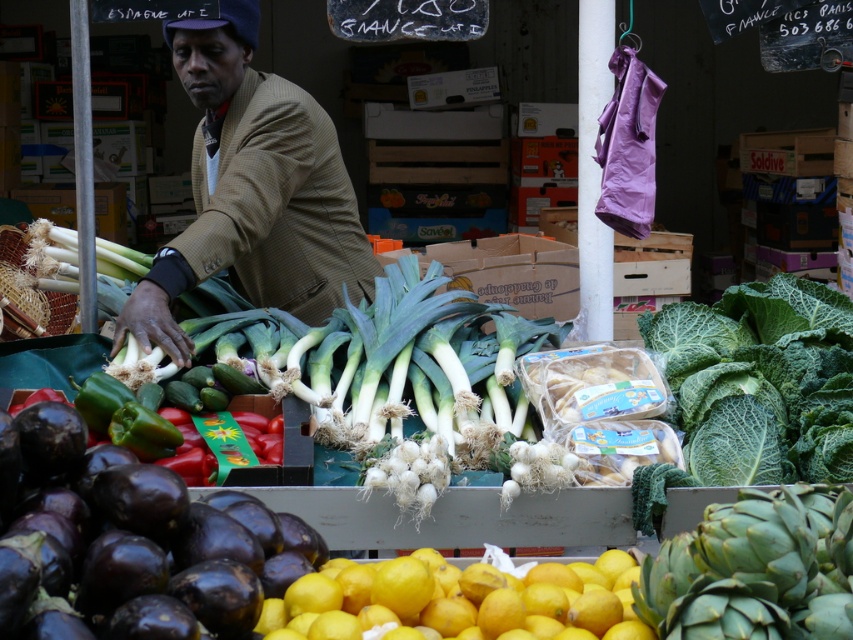
Question: Can you confirm if brown woolen jacket at center is positioned to the right of green leafy artichoke at lower right?

Choices:
 (A) no
 (B) yes

Answer: (A)

Question: Which point appears closest to the camera in this image?

Choices:
 (A) (520, 593)
 (B) (762, 552)
 (C) (276, 109)

Answer: (B)

Question: Which of these objects is positioned closest to the brown woolen jacket at center?

Choices:
 (A) yellow matte lemons at lower center
 (B) green leafy artichoke at lower right

Answer: (A)

Question: Which point is farther to the camera?

Choices:
 (A) yellow matte lemons at lower center
 (B) green leafy artichoke at lower right

Answer: (A)

Question: Is brown woolen jacket at center further to the viewer compared to yellow matte lemons at lower center?

Choices:
 (A) no
 (B) yes

Answer: (B)

Question: Is brown woolen jacket at center to the right of yellow matte lemons at lower center from the viewer's perspective?

Choices:
 (A) yes
 (B) no

Answer: (B)